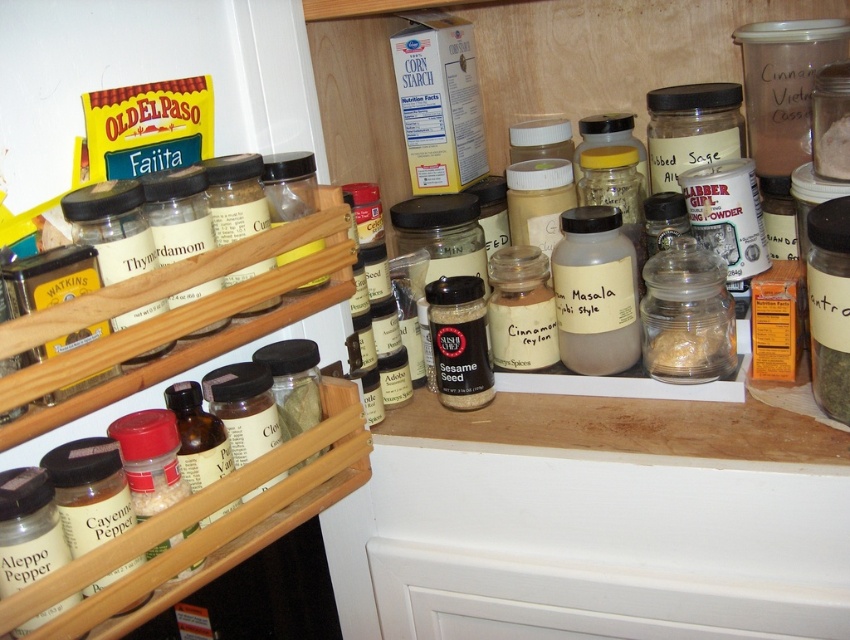
You are organizing a kitchen and need to place a new spice jar exactly at the point marked by coordinates point (177, 316). Based on the scene, where should you place it?

The point (177, 316) corresponds to the clear plastic spice rack at left, so you should place the new spice jar on the clear plastic spice rack at left.